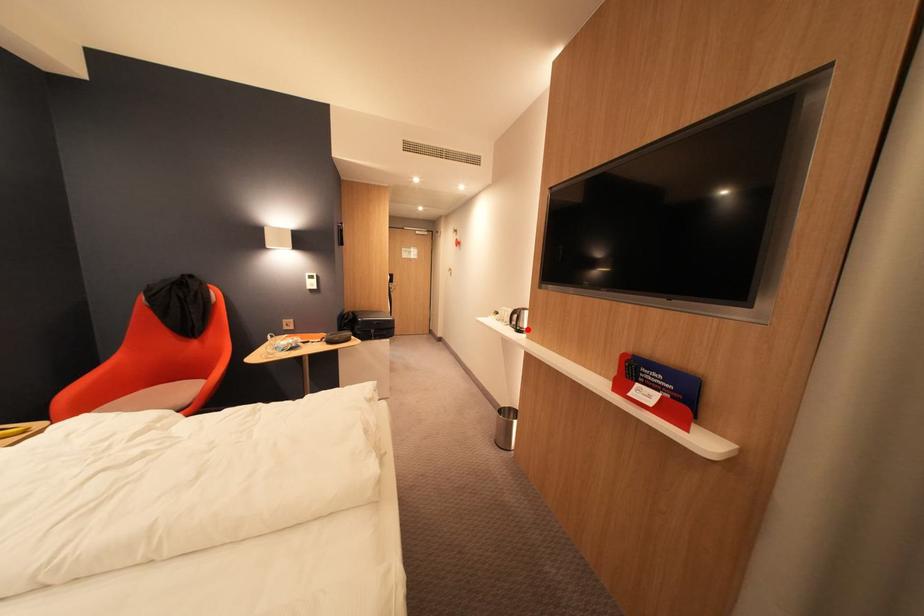
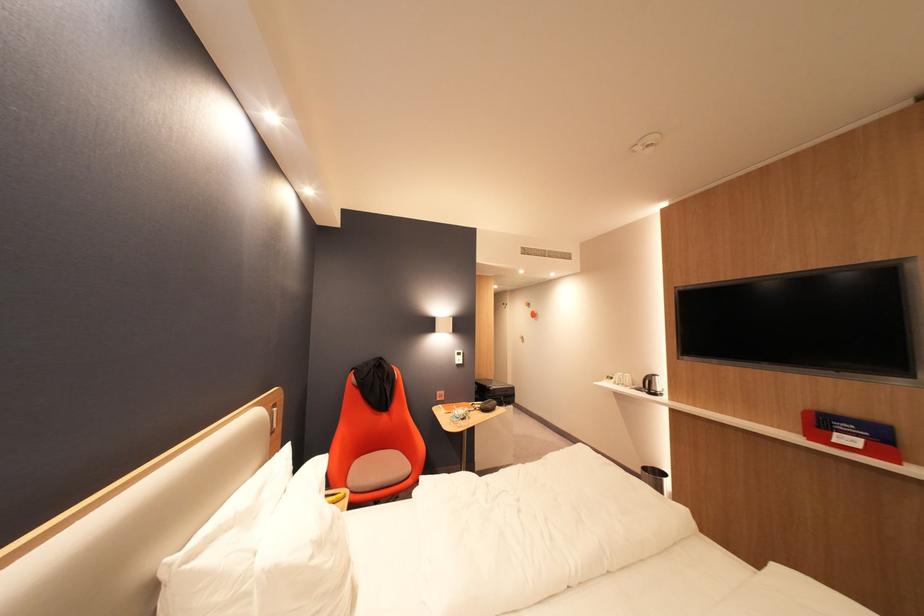
In the second image, find the point that corresponds to the highlighted location in the first image.

(662, 392)